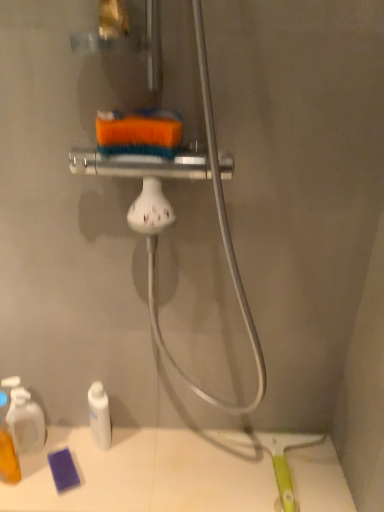
Question: Is translucent plastic bottle at lower left, placed as the third toiletry when sorted from right to left, facing towards white matte bottle at lower left, the 1th toiletry positioned from the right?

Choices:
 (A) yes
 (B) no

Answer: (B)

Question: Can you confirm if translucent plastic bottle at lower left, placed as the third toiletry when sorted from right to left, is thinner than white matte bottle at lower left, which is the 3th toiletry from left to right?

Choices:
 (A) yes
 (B) no

Answer: (B)

Question: Is translucent plastic bottle at lower left, placed as the first toiletry when sorted from left to right, far from white matte bottle at lower left, the 1th toiletry positioned from the right?

Choices:
 (A) yes
 (B) no

Answer: (B)

Question: Is translucent plastic bottle at lower left, placed as the third toiletry when sorted from right to left, shorter than white matte bottle at lower left, the 1th toiletry positioned from the right?

Choices:
 (A) no
 (B) yes

Answer: (A)

Question: Is translucent plastic bottle at lower left, placed as the first toiletry when sorted from left to right, next to white matte bottle at lower left, the 1th toiletry positioned from the right?

Choices:
 (A) yes
 (B) no

Answer: (B)

Question: Would you say translucent plastic spray bottle at lower left, placed as the second toiletry when sorted from right to left, is to the left or to the right of white matte bottle at lower left, which is the 3th toiletry from left to right, in the picture?

Choices:
 (A) right
 (B) left

Answer: (B)

Question: In terms of height, does translucent plastic spray bottle at lower left, placed as the second toiletry when sorted from right to left, look taller or shorter compared to white matte bottle at lower left, which is the 3th toiletry from left to right?

Choices:
 (A) tall
 (B) short

Answer: (A)

Question: From a real-world perspective, is translucent plastic spray bottle at lower left, placed as the second toiletry when sorted from right to left, positioned above or below white matte bottle at lower left, which is the 3th toiletry from left to right?

Choices:
 (A) below
 (B) above

Answer: (B)

Question: In terms of width, does translucent plastic spray bottle at lower left, arranged as the second toiletry when viewed from the left, look wider or thinner when compared to white matte bottle at lower left, which is the 3th toiletry from left to right?

Choices:
 (A) thin
 (B) wide

Answer: (B)

Question: Is translucent plastic bottle at lower left, placed as the third toiletry when sorted from right to left, inside the boundaries of white matte bottle at lower left, which is the 3th toiletry from left to right, or outside?

Choices:
 (A) outside
 (B) inside

Answer: (A)

Question: From the image's perspective, is translucent plastic bottle at lower left, placed as the first toiletry when sorted from left to right, above or below white matte bottle at lower left, the 1th toiletry positioned from the right?

Choices:
 (A) above
 (B) below

Answer: (B)

Question: Is translucent plastic bottle at lower left, placed as the third toiletry when sorted from right to left, taller or shorter than white matte bottle at lower left, the 1th toiletry positioned from the right?

Choices:
 (A) tall
 (B) short

Answer: (A)

Question: Relative to white matte bottle at lower left, which is the 3th toiletry from left to right, is translucent plastic bottle at lower left, placed as the third toiletry when sorted from right to left, in front or behind?

Choices:
 (A) behind
 (B) front

Answer: (B)

Question: Relative to translucent plastic bottle at lower left, placed as the first toiletry when sorted from left to right, is white matte bottle at lower left, the 1th toiletry positioned from the right, in front or behind?

Choices:
 (A) behind
 (B) front

Answer: (A)

Question: From the image's perspective, is white matte bottle at lower left, which is the 3th toiletry from left to right, positioned above or below translucent plastic bottle at lower left, placed as the first toiletry when sorted from left to right?

Choices:
 (A) below
 (B) above

Answer: (B)